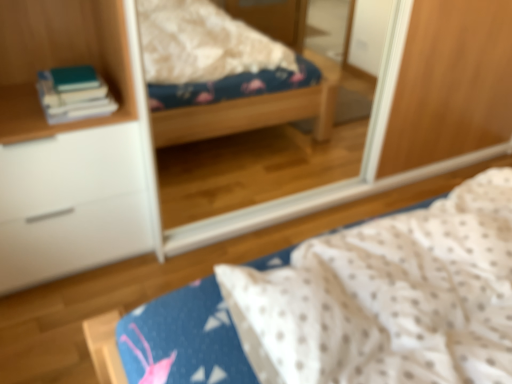
Question: From the image's perspective, is white matte cabinet at left below hardcover books at left?

Choices:
 (A) yes
 (B) no

Answer: (A)

Question: From a real-world perspective, is white matte cabinet at left under hardcover books at left?

Choices:
 (A) no
 (B) yes

Answer: (B)

Question: Is white matte cabinet at left looking in the opposite direction of hardcover books at left?

Choices:
 (A) yes
 (B) no

Answer: (B)

Question: From the image's perspective, is white matte cabinet at left located above hardcover books at left?

Choices:
 (A) no
 (B) yes

Answer: (A)

Question: Can you confirm if white matte cabinet at left is taller than hardcover books at left?

Choices:
 (A) no
 (B) yes

Answer: (B)

Question: From the image's perspective, is clear glass mirror at upper center located above or below white matte cabinet at left?

Choices:
 (A) above
 (B) below

Answer: (A)

Question: From a real-world perspective, relative to white matte cabinet at left, is clear glass mirror at upper center vertically above or below?

Choices:
 (A) above
 (B) below

Answer: (A)

Question: Relative to white matte cabinet at left, is clear glass mirror at upper center in front or behind?

Choices:
 (A) front
 (B) behind

Answer: (A)

Question: Considering the positions of clear glass mirror at upper center and white matte cabinet at left in the image, is clear glass mirror at upper center bigger or smaller than white matte cabinet at left?

Choices:
 (A) big
 (B) small

Answer: (A)

Question: In the image, is clear glass mirror at upper center positioned in front of or behind hardcover books at left?

Choices:
 (A) front
 (B) behind

Answer: (A)

Question: Is clear glass mirror at upper center bigger or smaller than hardcover books at left?

Choices:
 (A) small
 (B) big

Answer: (B)

Question: In terms of width, does clear glass mirror at upper center look wider or thinner when compared to hardcover books at left?

Choices:
 (A) wide
 (B) thin

Answer: (B)

Question: Is point (189, 170) positioned closer to the camera than point (68, 89)?

Choices:
 (A) farther
 (B) closer

Answer: (A)

Question: Considering the positions of white matte cabinet at left and white dotted fabric at center in the image, is white matte cabinet at left taller or shorter than white dotted fabric at center?

Choices:
 (A) short
 (B) tall

Answer: (B)

Question: Relative to white dotted fabric at center, is white matte cabinet at left in front or behind?

Choices:
 (A) front
 (B) behind

Answer: (B)